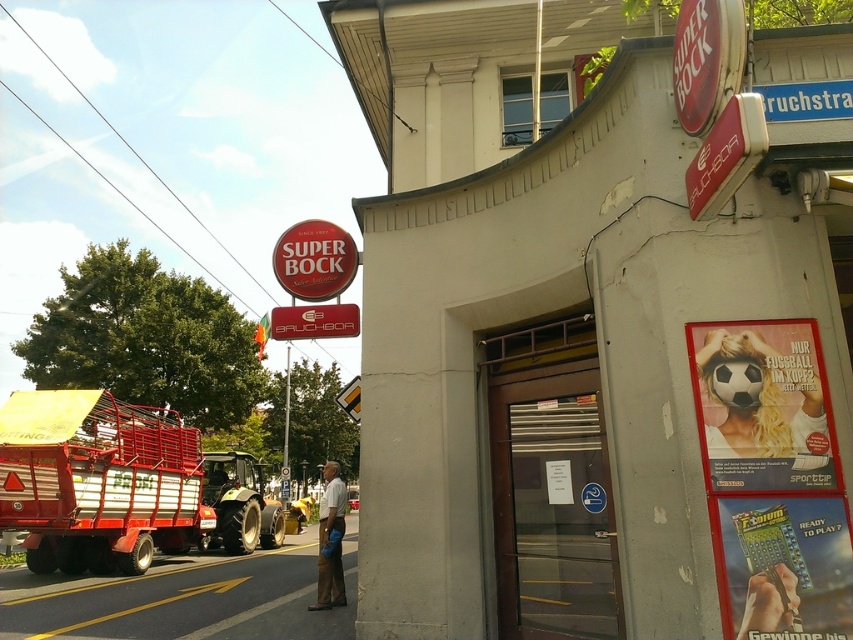
Based on the photo, you are standing at the entrance of the building. You need to move the metallic red trailer at left to the other side of the street. The street has a width of 10 meters. Can you safely move the trailer without crossing the center line?

The metallic red trailer at left and camera are 9.34 meters apart. Since the street is 10 meters wide, moving the trailer 9.34 meters would place it just short of the center line, allowing safe movement without crossing it.

You are a delivery person who needs to park your metallic red trailer at left near the matte plastic poster at right. Can you park the trailer to the left of the poster without blocking the entrance?

The metallic red trailer at left is already positioned on the left side of the matte plastic poster at right, so parking it there would not block the entrance.